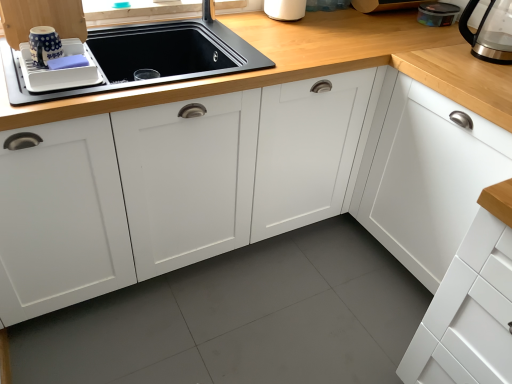
Where is `free location in front of transparent glass coffeepot at upper right`? This screenshot has width=512, height=384. free location in front of transparent glass coffeepot at upper right is located at coordinates (483, 66).